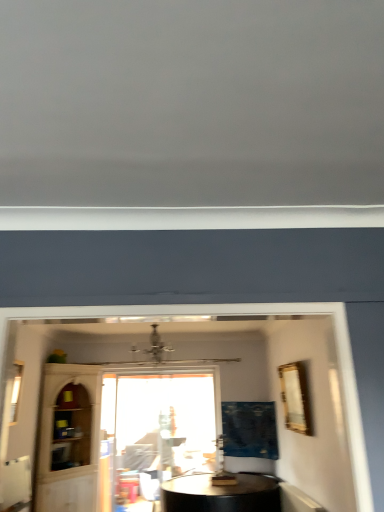
Question: Should I look upward or downward to see gold metallic picture frame at upper right?

Choices:
 (A) up
 (B) down

Answer: (B)

Question: Is blue fabric curtain at center positioned behind transparent glass cabinet at lower left?

Choices:
 (A) no
 (B) yes

Answer: (B)

Question: Does blue fabric curtain at center have a lesser height compared to transparent glass cabinet at lower left?

Choices:
 (A) yes
 (B) no

Answer: (A)

Question: Would you say blue fabric curtain at center is outside transparent glass cabinet at lower left?

Choices:
 (A) yes
 (B) no

Answer: (A)

Question: Considering the relative positions of blue fabric curtain at center and transparent glass cabinet at lower left in the image provided, is blue fabric curtain at center in front of transparent glass cabinet at lower left?

Choices:
 (A) no
 (B) yes

Answer: (A)

Question: Is blue fabric curtain at center wider than transparent glass cabinet at lower left?

Choices:
 (A) no
 (B) yes

Answer: (B)

Question: Considering the relative positions of blue fabric curtain at center and transparent glass cabinet at lower left in the image provided, is blue fabric curtain at center to the left of transparent glass cabinet at lower left from the viewer's perspective?

Choices:
 (A) yes
 (B) no

Answer: (B)

Question: Is the depth of clear glass window at left, the 1th window in the top-to-bottom sequence, less than that of blue fabric curtain at center?

Choices:
 (A) yes
 (B) no

Answer: (A)

Question: From a real-world perspective, is clear glass window at left, which is the second window in bottom-to-top order, on blue fabric curtain at center?

Choices:
 (A) yes
 (B) no

Answer: (A)

Question: Can you confirm if clear glass window at left, which is the second window in bottom-to-top order, is bigger than blue fabric curtain at center?

Choices:
 (A) no
 (B) yes

Answer: (A)

Question: Is clear glass window at left, which is the 1th window from front to back, to the left of blue fabric curtain at center from the viewer's perspective?

Choices:
 (A) yes
 (B) no

Answer: (A)

Question: Can you confirm if clear glass window at left, which is the second window in bottom-to-top order, is shorter than blue fabric curtain at center?

Choices:
 (A) no
 (B) yes

Answer: (B)

Question: From the image's perspective, would you say clear glass window at left, which is the first window in left-to-right order, is shown under blue fabric curtain at center?

Choices:
 (A) yes
 (B) no

Answer: (B)

Question: Does transparent glass cabinet at lower left appear on the right side of blue fabric curtain at center?

Choices:
 (A) yes
 (B) no

Answer: (B)